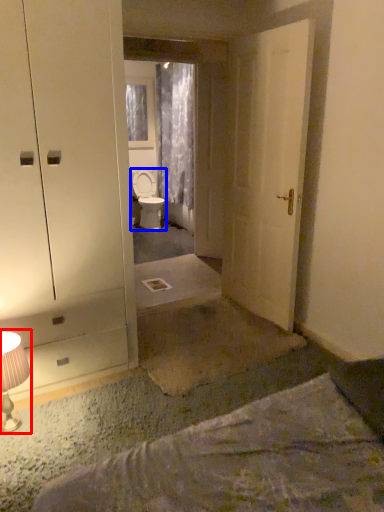
Question: Which object appears farthest to the camera in this image, table lamp (highlighted by a red box) or toilet (highlighted by a blue box)?

Choices:
 (A) table lamp
 (B) toilet

Answer: (B)